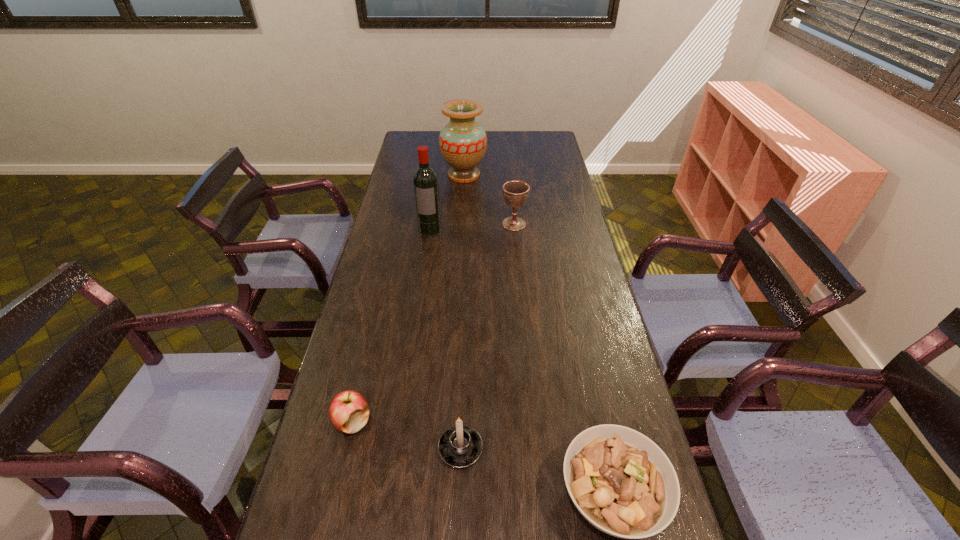
Locate an element on the screen. vacant area located with a handle on the side of the candle holder is located at coordinates 464,353.

You are a GUI agent. You are given a task and a screenshot of the screen. Output one action in this format:
    pyautogui.click(x=<x>, y=<y>)
    Task: Click on the vacant space located on the back of the leftmost object
    
    Given the screenshot: What is the action you would take?
    pyautogui.click(x=368, y=357)

Identify the location of object that is at the left edge. The width and height of the screenshot is (960, 540). (349, 411).

At what (x,y) coordinates should I click in order to perform the action: click on vacant space at the far edge of the desktop. Please return your answer as a coordinate pair (x, y). The height and width of the screenshot is (540, 960). Looking at the image, I should click on (495, 136).

The height and width of the screenshot is (540, 960). I want to click on vacant space at the left edge of the desktop, so click(x=409, y=216).

Where is `vacant space at the far left corner`? vacant space at the far left corner is located at coordinates (422, 137).

Where is `vacant space at the far right corner of the desktop`? The image size is (960, 540). vacant space at the far right corner of the desktop is located at coordinates (541, 150).

At what (x,y) coordinates should I click in order to perform the action: click on free spot between the chalice and the third shortest object. Please return your answer as a coordinate pair (x, y). This screenshot has width=960, height=540. Looking at the image, I should click on (488, 336).

Find the location of `free space between the farthest object and the candle holder`. free space between the farthest object and the candle holder is located at coordinates (463, 312).

Where is `vacant space in between the chalice and the wine bottle`? vacant space in between the chalice and the wine bottle is located at coordinates (472, 226).